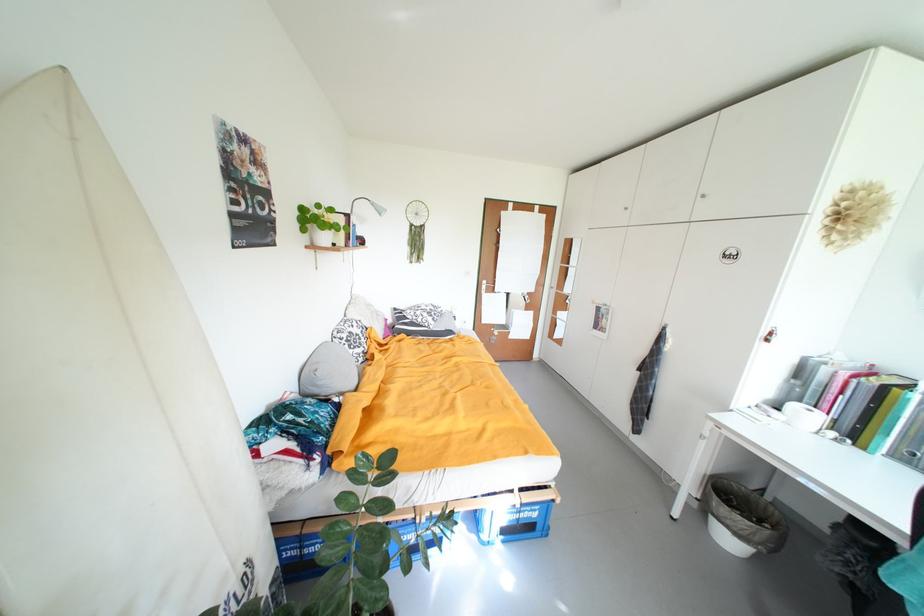
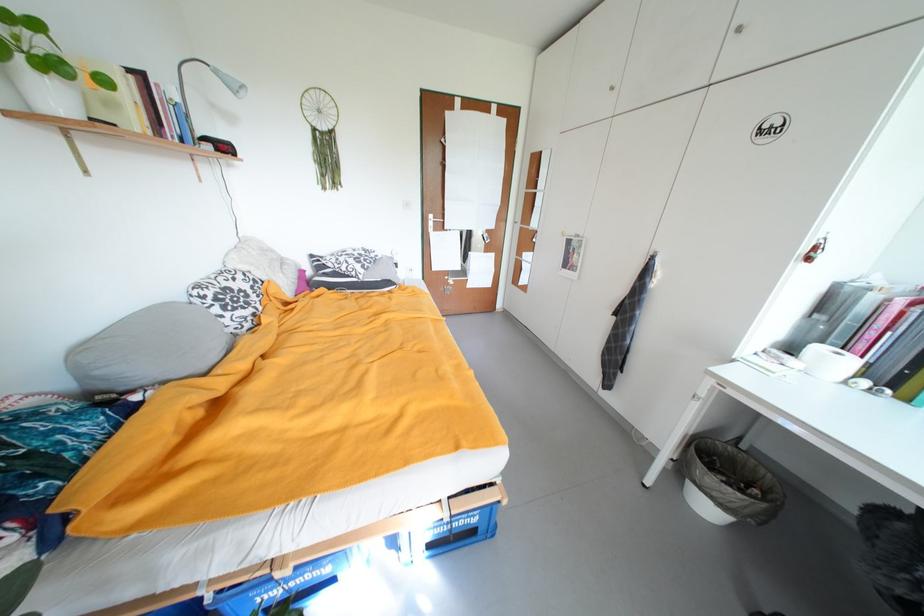
In the second image, find the point that corresponds to point (325, 208) in the first image.

(15, 18)